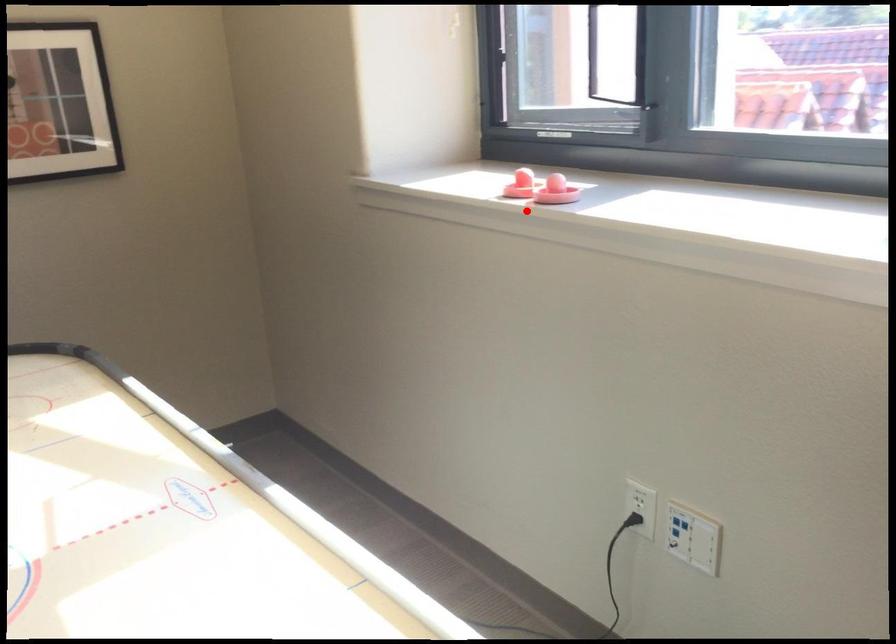
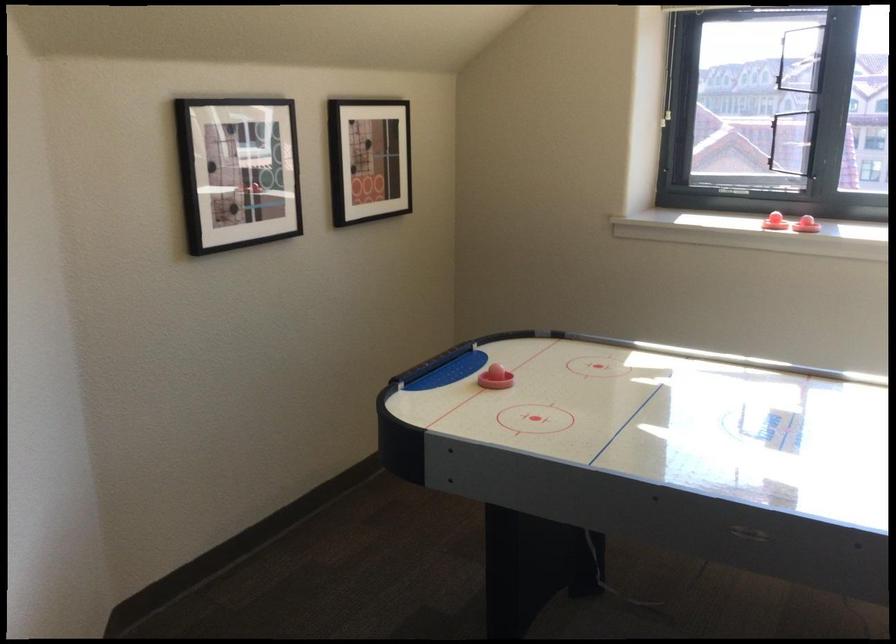
Locate, in the second image, the point that corresponds to the highlighted location in the first image.

(806, 225)